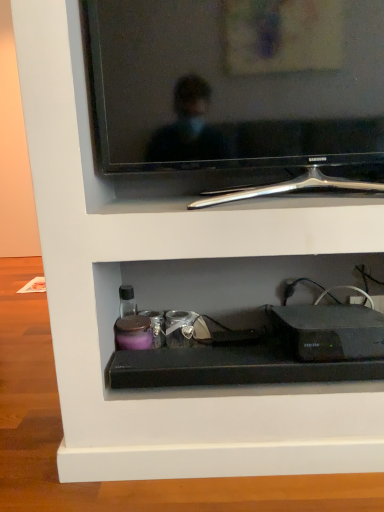
Question: Is black plastic router at lower center shorter than black glossy tv at upper center?

Choices:
 (A) no
 (B) yes

Answer: (B)

Question: Is black plastic router at lower center outside of black glossy tv at upper center?

Choices:
 (A) no
 (B) yes

Answer: (B)

Question: From the image's perspective, is black plastic router at lower center beneath black glossy tv at upper center?

Choices:
 (A) no
 (B) yes

Answer: (B)

Question: Is black plastic router at lower center beside black glossy tv at upper center?

Choices:
 (A) yes
 (B) no

Answer: (B)

Question: Can you confirm if black plastic router at lower center is taller than black glossy tv at upper center?

Choices:
 (A) yes
 (B) no

Answer: (B)

Question: Can you confirm if black plastic router at lower center is bigger than black glossy tv at upper center?

Choices:
 (A) yes
 (B) no

Answer: (B)

Question: Is black plastic router at lower center surrounded by black glossy tv at upper center?

Choices:
 (A) no
 (B) yes

Answer: (A)

Question: Can you confirm if black glossy tv at upper center is positioned to the right of black plastic router at lower center?

Choices:
 (A) yes
 (B) no

Answer: (B)

Question: Considering the relative sizes of black glossy tv at upper center and black plastic router at lower center in the image provided, is black glossy tv at upper center wider than black plastic router at lower center?

Choices:
 (A) yes
 (B) no

Answer: (B)

Question: Is black glossy tv at upper center looking in the opposite direction of black plastic router at lower center?

Choices:
 (A) yes
 (B) no

Answer: (B)

Question: Considering the relative positions of black glossy tv at upper center and black plastic router at lower center in the image provided, is black glossy tv at upper center behind black plastic router at lower center?

Choices:
 (A) yes
 (B) no

Answer: (B)

Question: Can you confirm if black glossy tv at upper center is taller than black plastic router at lower center?

Choices:
 (A) no
 (B) yes

Answer: (B)

Question: Relative to black glossy tv at upper center, is black plastic router at lower center in front or behind?

Choices:
 (A) behind
 (B) front

Answer: (A)